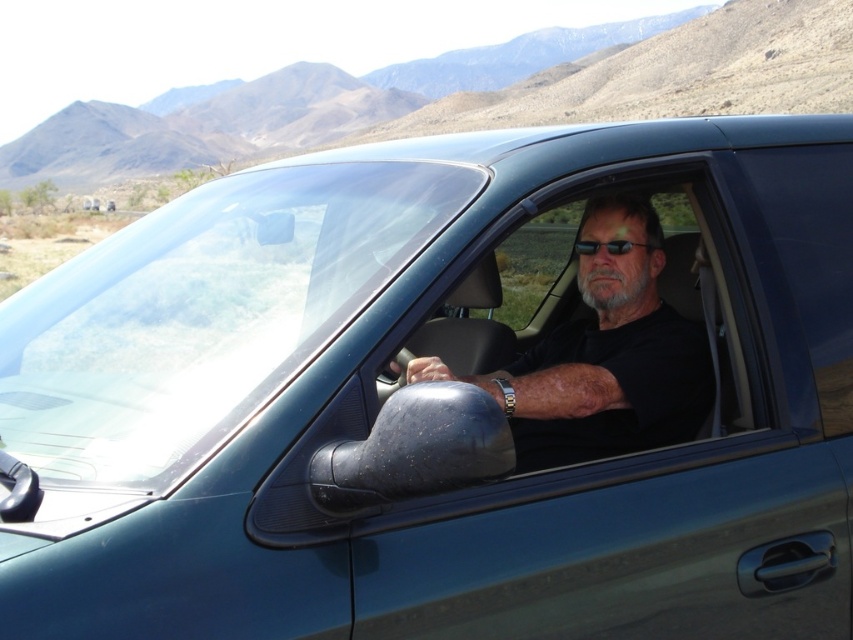
You are a photographer standing at a certain distance from the subject, who is wearing a black matte shirt at center. You want to capture a portrait that requires the subject to be exactly 8 feet away from the camera. Should you move closer or farther away from the subject to achieve this?

The black matte shirt at center is currently 6.66 feet away from the camera. To reach the desired 8 feet distance for the portrait, you should move farther away from the subject.

You are a passenger in the dark vehicle and want to place a 10 inch long object between the transparent glass window at center and the black plastic sunglasses at center. Is there enough space?

The distance between the transparent glass window at center and the black plastic sunglasses at center is 20.73 inches, so yes, there is enough space to place a 10 inch long object between them.